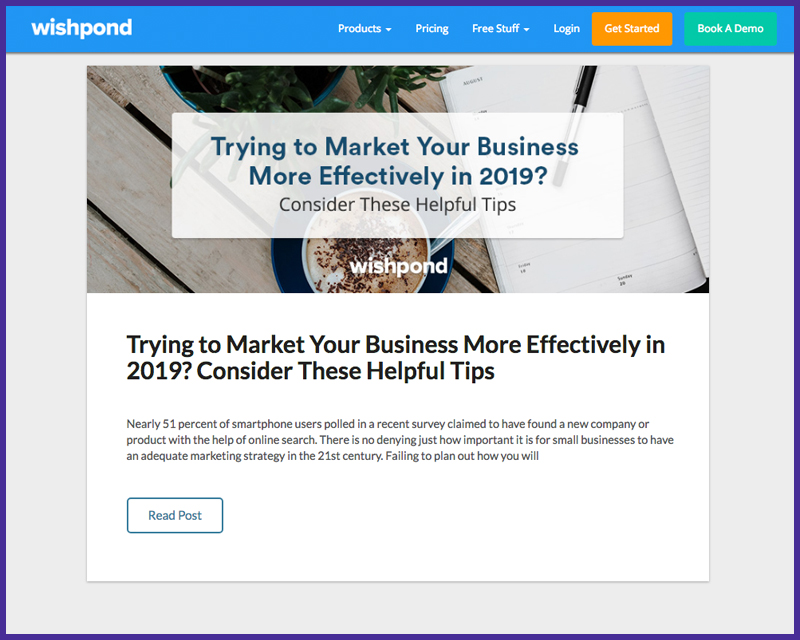
Locate an element on the screen. This screenshot has width=800, height=640. table is located at coordinates (110, 210).